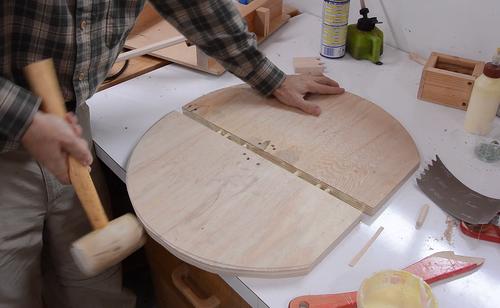
At what (x,y) coordinates should I click in order to perform the action: click on wooden objects. Please return your answer as a coordinate pair (x, y). Looking at the image, I should click on click(x=262, y=179), click(x=333, y=145), click(x=89, y=207), click(x=180, y=55), click(x=446, y=85), click(x=420, y=216).